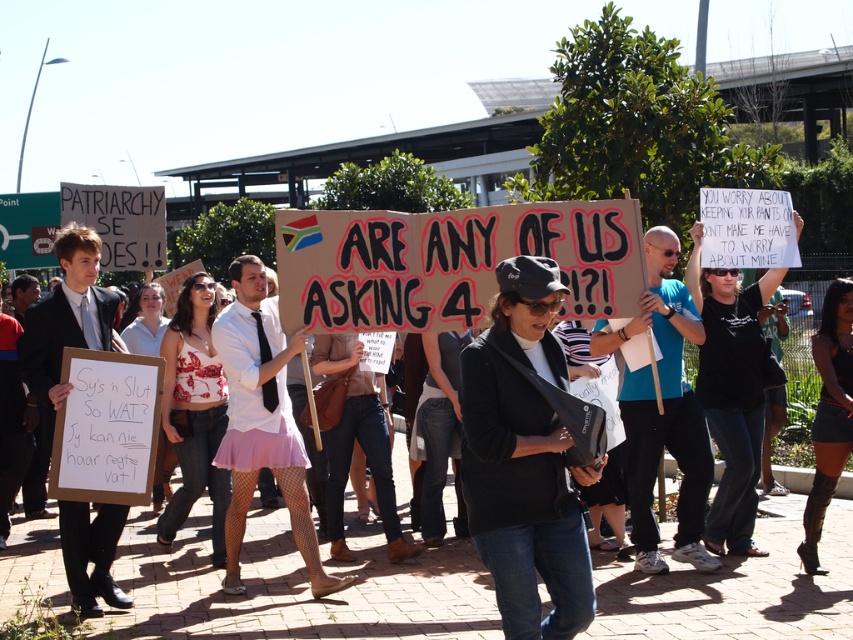
You are a photographer positioned at the front of the protest route. You want to capture both the black matte jacket at center and the black fabric shirt at center in your shot. Which object will appear larger in your photo?

The black matte jacket at center will appear larger in the photo because it is closer to the viewer than the black fabric shirt at center.